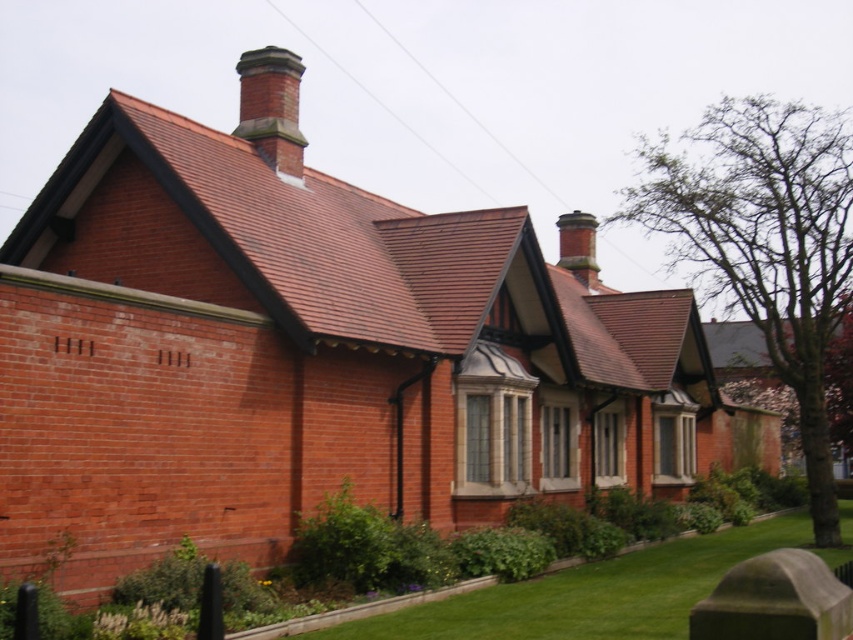
Does green grass at lower center come behind brick chimney at upper center?

No, green grass at lower center is closer to the viewer.

Can you confirm if green grass at lower center is bigger than brick chimney at upper center?

No.

The image size is (853, 640). I want to click on green grass at lower center, so pyautogui.click(x=589, y=595).

This screenshot has width=853, height=640. Identify the location of green grass at lower center. (589, 595).

Which is more to the right, brick chimney at upper center or smooth brick chimney at upper center?

smooth brick chimney at upper center is more to the right.

Between brick chimney at upper center and smooth brick chimney at upper center, which one is positioned higher?

brick chimney at upper center is above.

Who is more forward, (299, 65) or (567, 250)?

Positioned in front is point (299, 65).

Find the location of a particular element. The height and width of the screenshot is (640, 853). brick chimney at upper center is located at coordinates (271, 108).

Is green grass at lower center wider than smooth brick chimney at upper center?

Correct, the width of green grass at lower center exceeds that of smooth brick chimney at upper center.

Identify the location of green grass at lower center. This screenshot has width=853, height=640. point(589,595).

Is point (585, 621) less distant than point (576, 227)?

Yes, it is.

This screenshot has width=853, height=640. I want to click on green grass at lower center, so click(x=589, y=595).